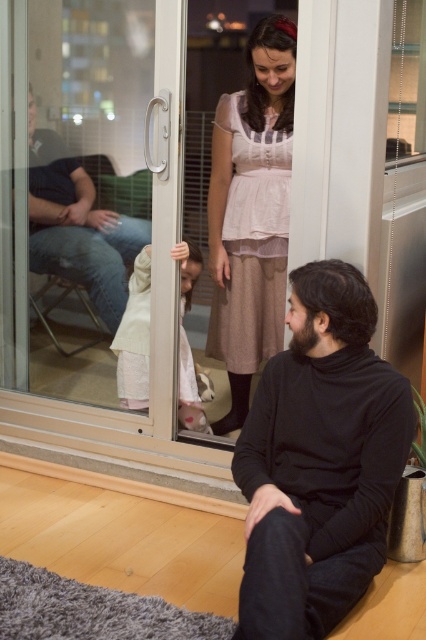
You are a delivery person who needs to place a small package between the pink fabric dress at center and the jeans at left. The package is 30 inches long. Can you fit it between them without moving either item?

The distance between the pink fabric dress at center and the jeans at left is 28.29 inches. Since the package is 30 inches long, it cannot fit between them without moving either item.

You are a fashion designer analyzing the clothing items in the scene. Which clothing item is wider between the black turtleneck sweater at center and the light pink fabric dress at center?

The black turtleneck sweater at center is wider than the light pink fabric dress at center.